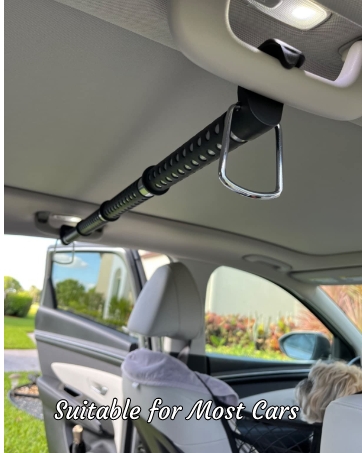
The height and width of the screenshot is (453, 362). Identify the location of chair. (179, 325).